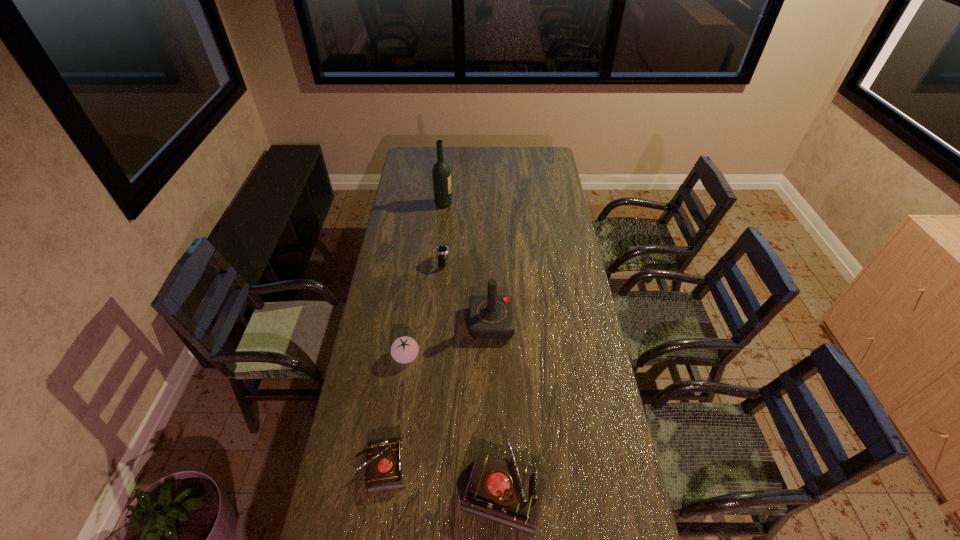
Identify the location of empty space that is in between the watch and the farthest object. (443, 234).

At what (x,y) coordinates should I click in order to perform the action: click on free point between the watch and the left diary. Please return your answer as a coordinate pair (x, y). Looking at the image, I should click on (413, 365).

The image size is (960, 540). I want to click on free spot between the tallest object and the shorter diary, so click(414, 335).

Find the location of `vacant area between the wine bottle and the tomato`. vacant area between the wine bottle and the tomato is located at coordinates (425, 280).

In order to click on free space that is in between the fourth nearest object and the fifth nearest object in this screenshot , I will do [467, 293].

Identify which object is the second nearest to the farthest object. Please provide its 2D coordinates. Your answer should be formatted as a tuple, i.e. [(x, y)], where the tuple contains the x and y coordinates of a point satisfying the conditions above.

[(491, 316)]

Identify which object is the nearest to the second tallest object. Please provide its 2D coordinates. Your answer should be formatted as a tuple, i.e. [(x, y)], where the tuple contains the x and y coordinates of a point satisfying the conditions above.

[(405, 349)]

The height and width of the screenshot is (540, 960). I want to click on vacant region that satisfies the following two spatial constraints: 1. on the labeled side of the tallest object; 2. on the front side of the shorter diary, so click(419, 467).

Locate an element on the screen. free space that satisfies the following two spatial constraints: 1. on the labeled side of the tallest object; 2. on the right side of the watch is located at coordinates (438, 263).

The height and width of the screenshot is (540, 960). In order to click on vacant area that satisfies the following two spatial constraints: 1. on the labeled side of the tallest object; 2. on the right side of the second farthest object in this screenshot , I will do `click(438, 263)`.